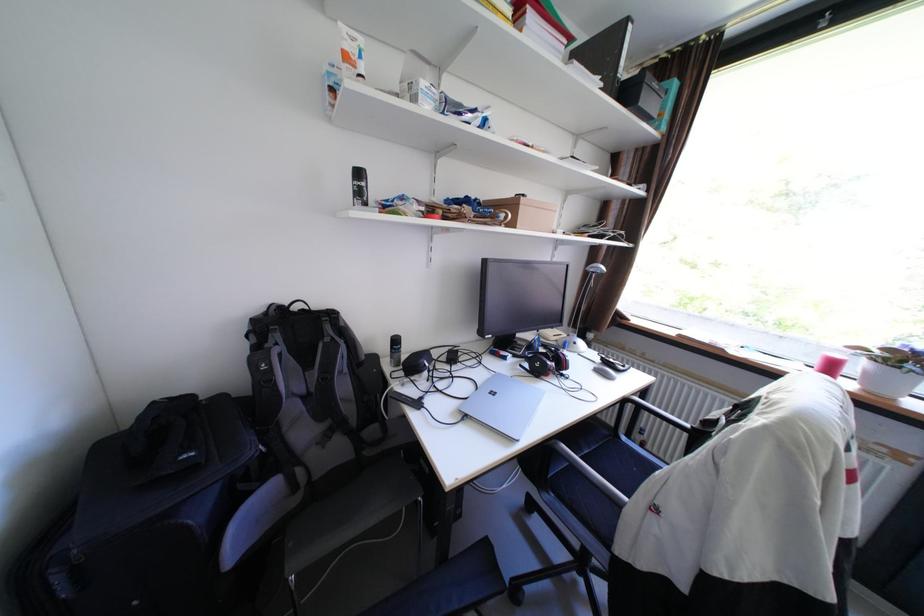
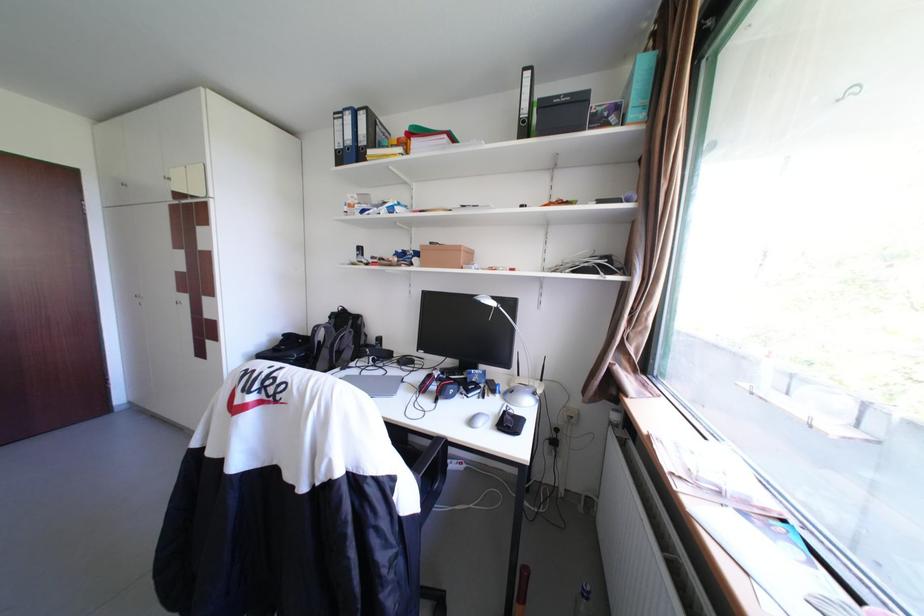
Find the pixel in the second image that matches [286,337] in the first image.

(344, 321)